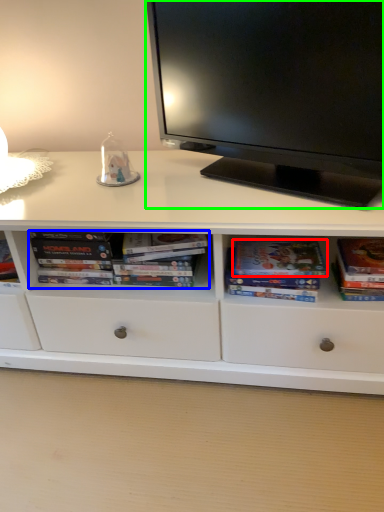
Question: Based on their relative distances, which object is nearer to paperback book (highlighted by a red box)? Choose from book (highlighted by a blue box) and television (highlighted by a green box).

Choices:
 (A) book
 (B) television

Answer: (A)